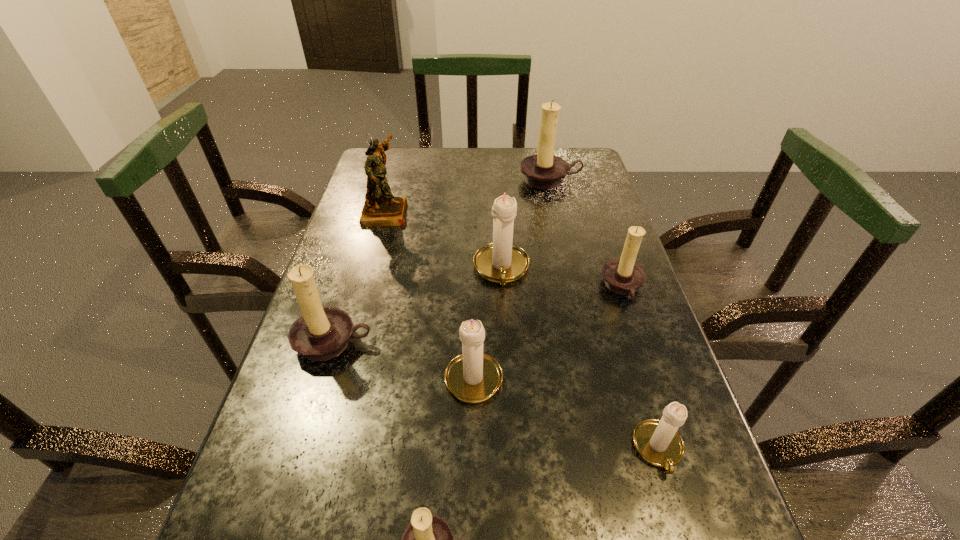
In order to click on the farthest object in this screenshot , I will do `click(542, 171)`.

Image resolution: width=960 pixels, height=540 pixels. I want to click on the farthest brown candle holder, so click(x=542, y=171).

Identify the location of the second farthest object. The width and height of the screenshot is (960, 540). (381, 208).

Find the location of a particular element. Image resolution: width=960 pixels, height=540 pixels. figurine is located at coordinates (381, 208).

Where is `the farthest white candle holder`? the farthest white candle holder is located at coordinates (501, 261).

The height and width of the screenshot is (540, 960). I want to click on the third farthest brown candle holder, so (x=321, y=333).

I want to click on the leftmost candle holder, so click(321, 333).

Find the location of a particular element. The width and height of the screenshot is (960, 540). the third biggest brown candle holder is located at coordinates (623, 276).

Locate an element on the screen. The image size is (960, 540). the second biggest white candle holder is located at coordinates (473, 377).

This screenshot has width=960, height=540. What are the coordinates of `the nearest white candle holder` in the screenshot? It's located at (658, 442).